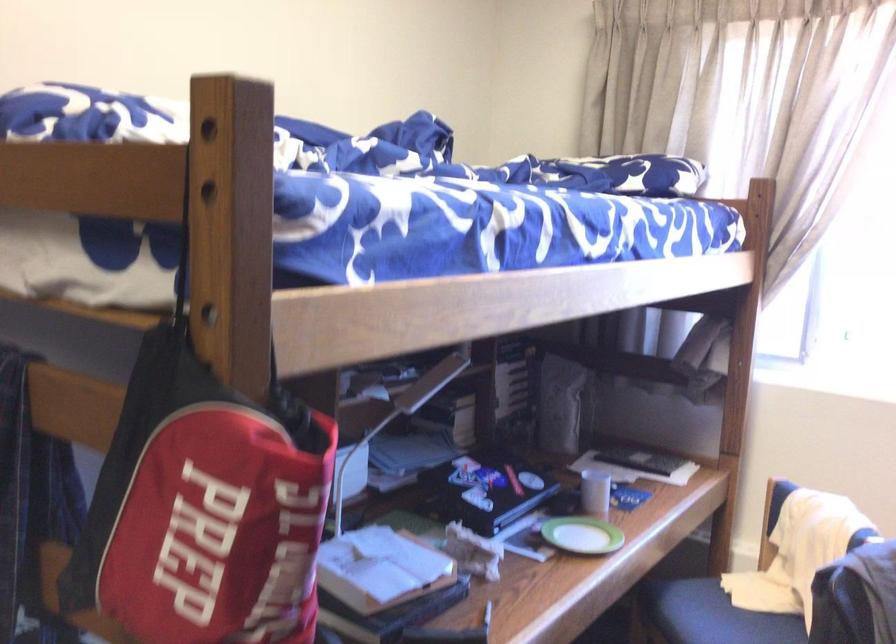
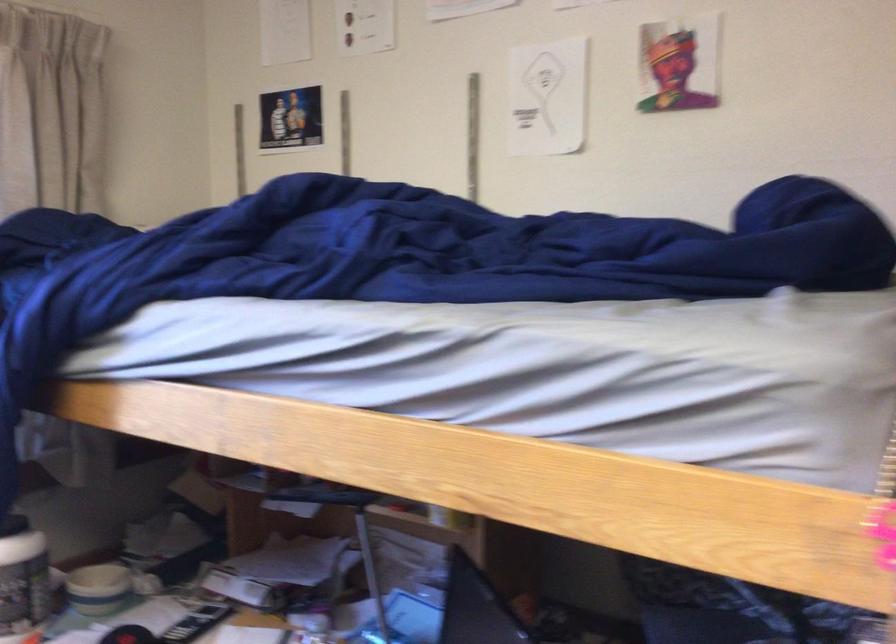
Question: The camera is either moving clockwise (left) or counter-clockwise (right) around the object. The first image is from the beginning of the video and the second image is from the end. Is the camera moving left or right when shooting the video?

Choices:
 (A) Left
 (B) Right

Answer: (A)